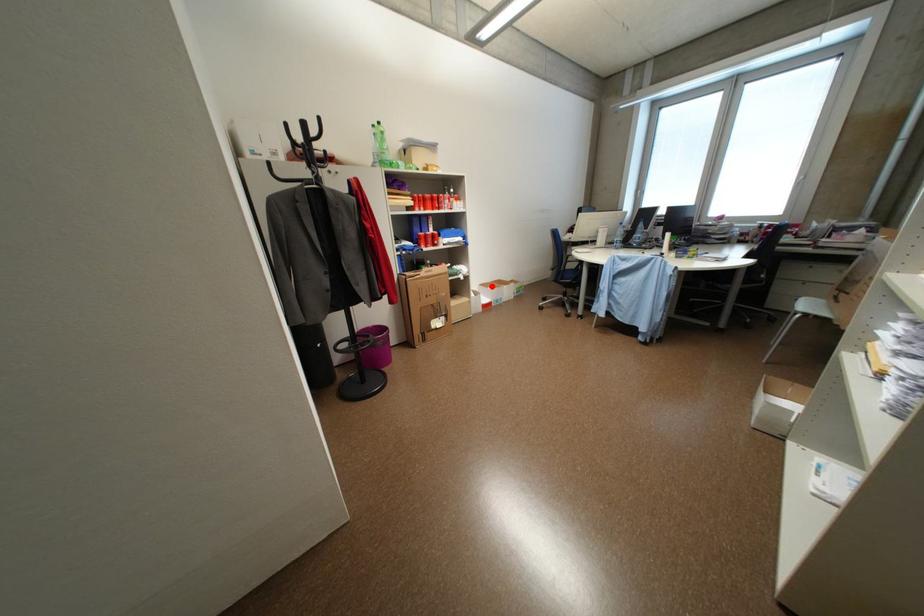
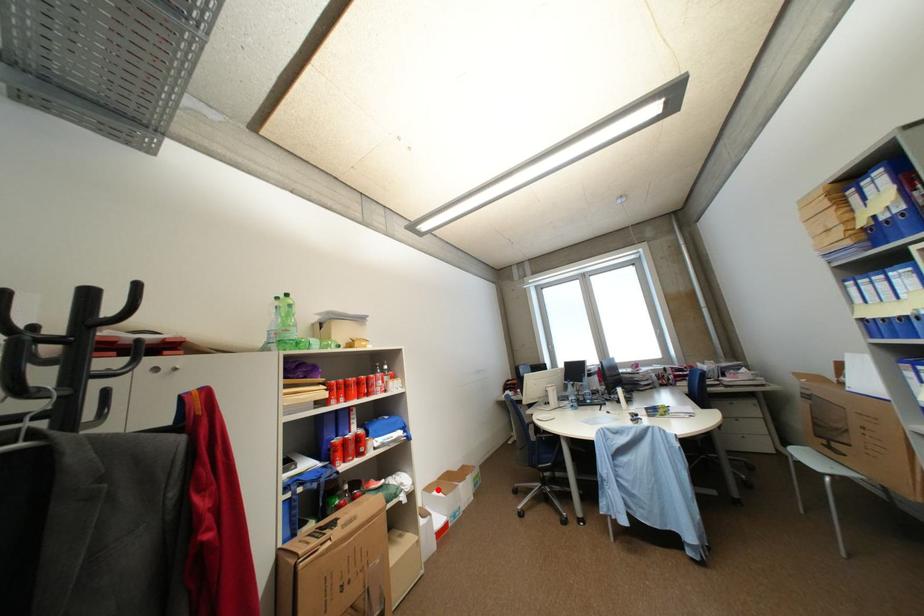
I am providing you with two images of the same scene from different viewpoints. A red point is marked on the first image and another point is marked on the second image. Does the point marked in image1 correspond to the same location as the one in image2?

Yes